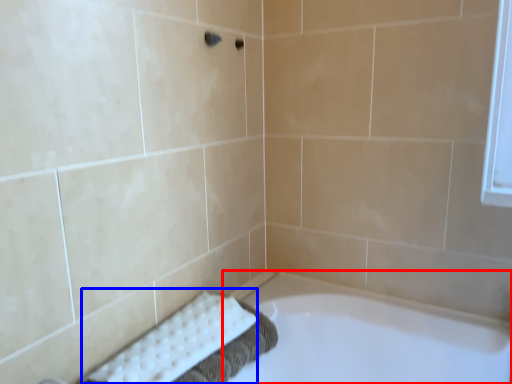
Question: Which point is further to the camera, bathtub (highlighted by a red box) or bath towel (highlighted by a blue box)?

Choices:
 (A) bathtub
 (B) bath towel

Answer: (B)